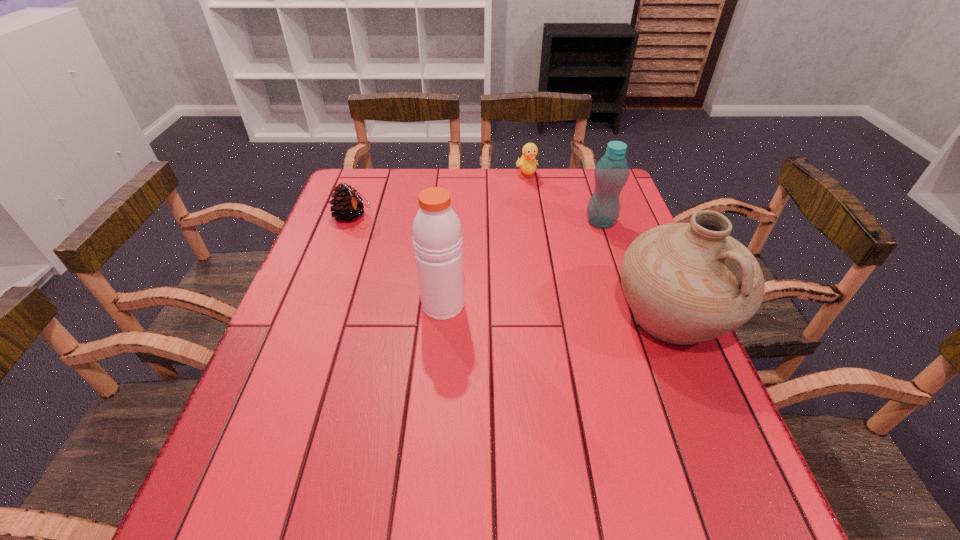
Locate an element on the screen. The image size is (960, 540). vacant space that's between the water bottle and the second object from left to right is located at coordinates (521, 264).

Find the location of `free area in between the fourth object from right to left and the water bottle`. free area in between the fourth object from right to left and the water bottle is located at coordinates (521, 264).

Image resolution: width=960 pixels, height=540 pixels. Find the location of `empty space between the third object from left to right and the water bottle`. empty space between the third object from left to right and the water bottle is located at coordinates (564, 199).

What are the coordinates of `empty space between the shaker and the farthest object` in the screenshot? It's located at (485, 241).

I want to click on free space between the pinecone and the pottery, so 513,266.

The height and width of the screenshot is (540, 960). What are the coordinates of `unoccupied position between the pottery and the fourth object from right to left` in the screenshot? It's located at (558, 311).

Locate an element on the screen. object that is the fourth closest to the pottery is located at coordinates (348, 204).

Locate an element on the screen. Image resolution: width=960 pixels, height=540 pixels. object that stands as the second closest to the farthest object is located at coordinates (690, 282).

This screenshot has height=540, width=960. In order to click on vacant position in the image that satisfies the following two spatial constraints: 1. on the front side of the pottery; 2. on the left side of the third object from right to left in this screenshot , I will do tap(548, 316).

The width and height of the screenshot is (960, 540). I want to click on vacant space that satisfies the following two spatial constraints: 1. on the front side of the pottery; 2. on the left side of the shaker, so click(x=442, y=316).